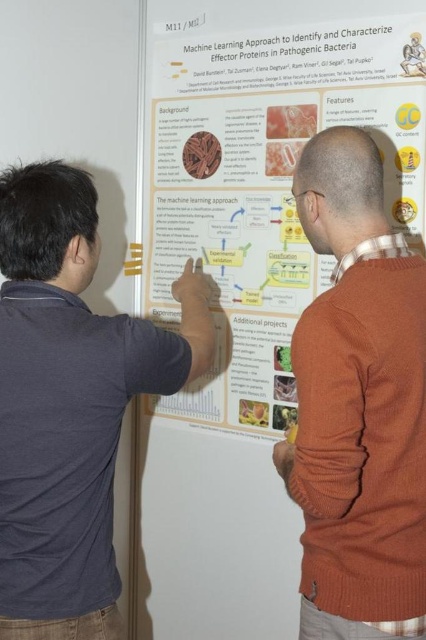
You are standing in front of the scientific poster and notice two people examining it. The poster has a title at the top and authors listed below. Which person is wearing the dark blue shirt at left?

The dark blue shirt at left is located at point [69,401], so the person wearing the dark blue shirt at left is positioned at that coordinate relative to the poster.

You are attending a scientific conference and see the white paper poster at center and the orange sweater at right. Which object is positioned more to the left?

The white paper poster at center is positioned more to the left than the orange sweater at right.

You are standing in front of the poster and notice the dark blue shirt at left and the white paper poster at center. Which object is positioned to the right of the other?

The white paper poster at center is to the right of the dark blue shirt at left.